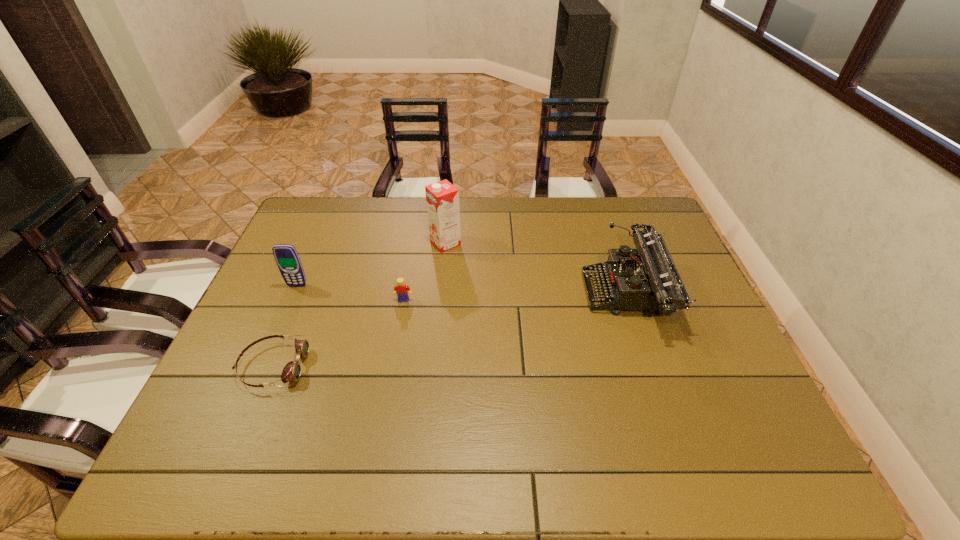
Find the location of a particular element. free space between the cellular telephone and the second shortest object is located at coordinates (350, 293).

The height and width of the screenshot is (540, 960). Identify the location of free space that is in between the cellular telephone and the typewriter. (462, 290).

Where is `blank region between the cellular telephone and the carton`? blank region between the cellular telephone and the carton is located at coordinates (372, 265).

You are a GUI agent. You are given a task and a screenshot of the screen. Output one action in this format:
    pyautogui.click(x=<x>, y=<y>)
    Task: Click on the third closest object to the shortest object
    
    Given the screenshot: What is the action you would take?
    pyautogui.click(x=442, y=198)

Select which object is the second closest to the tallest object. Please provide its 2D coordinates. Your answer should be formatted as a tuple, i.e. [(x, y)], where the tuple contains the x and y coordinates of a point satisfying the conditions above.

[(650, 281)]